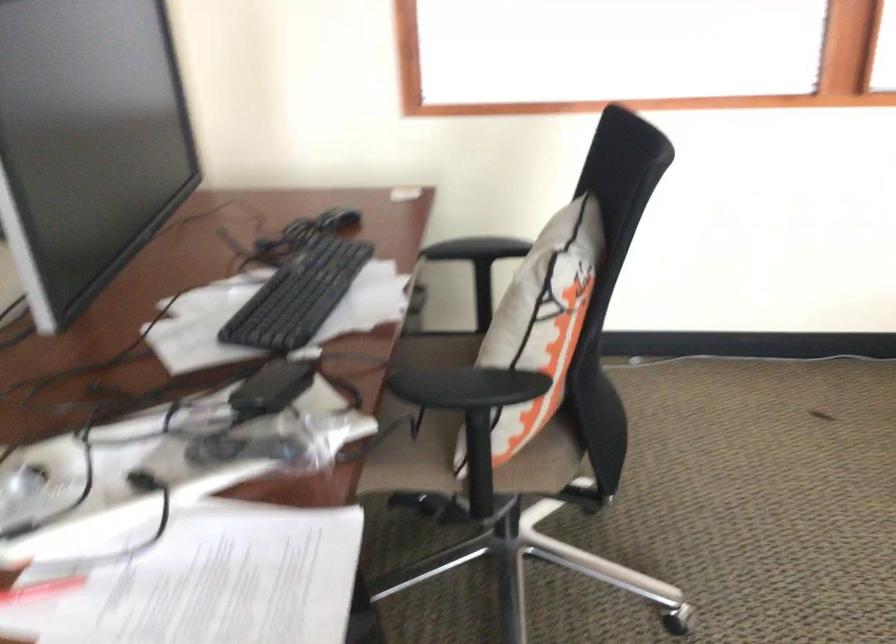
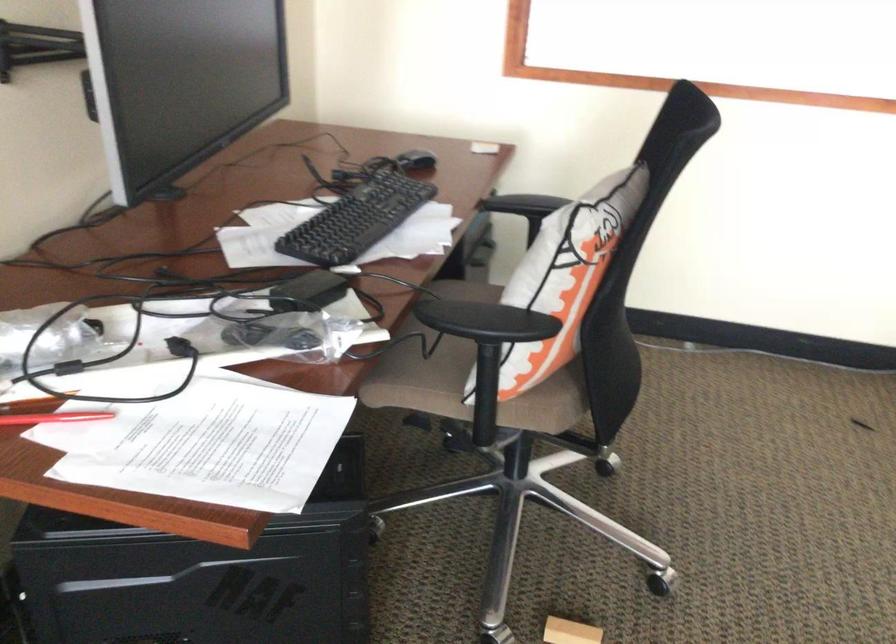
The point at (547,328) is marked in the first image. Where is the corresponding point in the second image?

(564, 277)